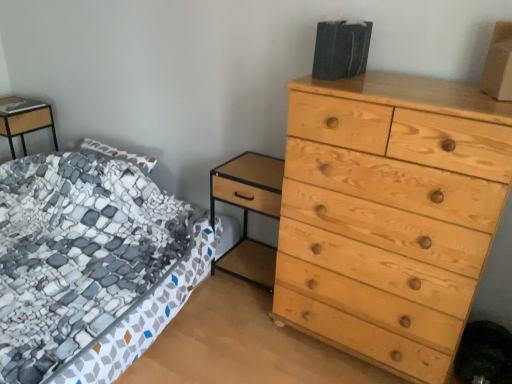
Question: Based on their sizes in the image, would you say light wood chest of drawers at right is bigger or smaller than patterned fabric bed at left?

Choices:
 (A) small
 (B) big

Answer: (A)

Question: Relative to patterned fabric bed at left, is light wood chest of drawers at right in front or behind?

Choices:
 (A) behind
 (B) front

Answer: (A)

Question: Estimate the real-world distances between objects in this image. Which object is farther from the matte wood nightstand at left, arranged as the 1th nightstand when viewed from the back?

Choices:
 (A) brown cardboard box at upper right
 (B) light wood/texture nightstand at center, positioned as the first nightstand in bottom-to-top order
 (C) light wood chest of drawers at right
 (D) patterned fabric bed at left

Answer: (A)

Question: Which object is the closest to the brown cardboard box at upper right?

Choices:
 (A) matte wood nightstand at left, arranged as the 2th nightstand when viewed from the front
 (B) patterned fabric bed at left
 (C) light wood chest of drawers at right
 (D) light wood/texture nightstand at center, the second nightstand from the top

Answer: (C)